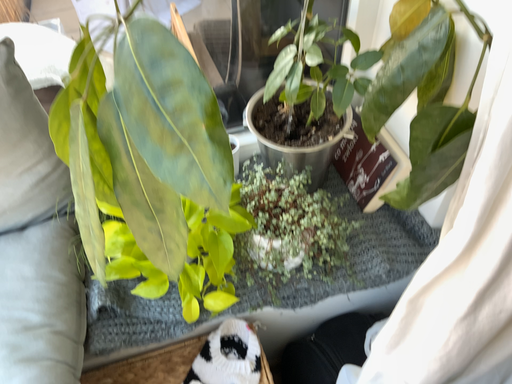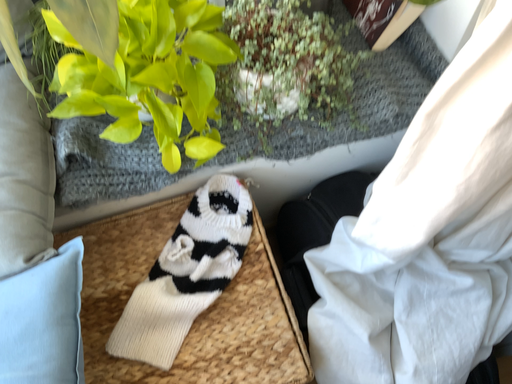
Question: Which way did the camera rotate in the video?

Choices:
 (A) rotated downward
 (B) rotated upward

Answer: (A)